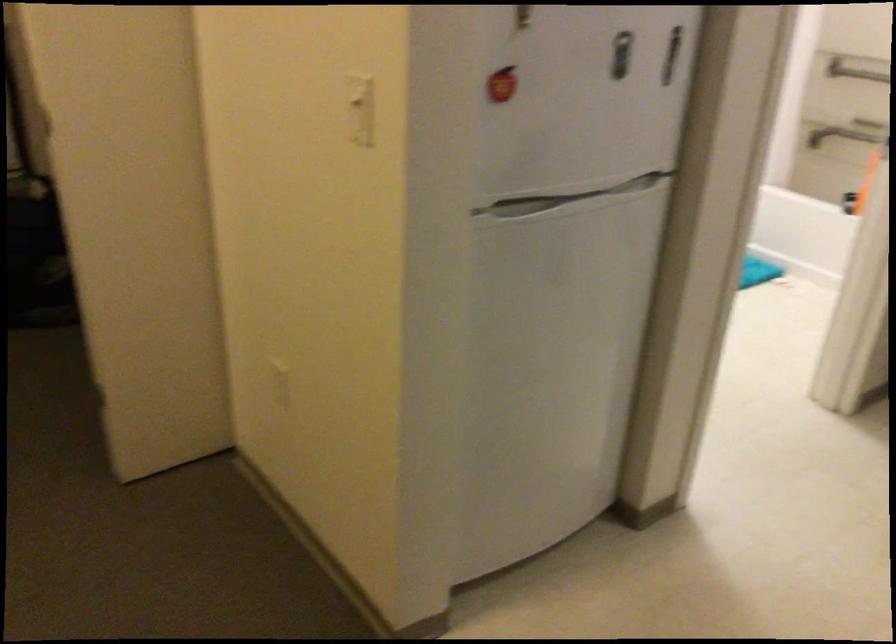
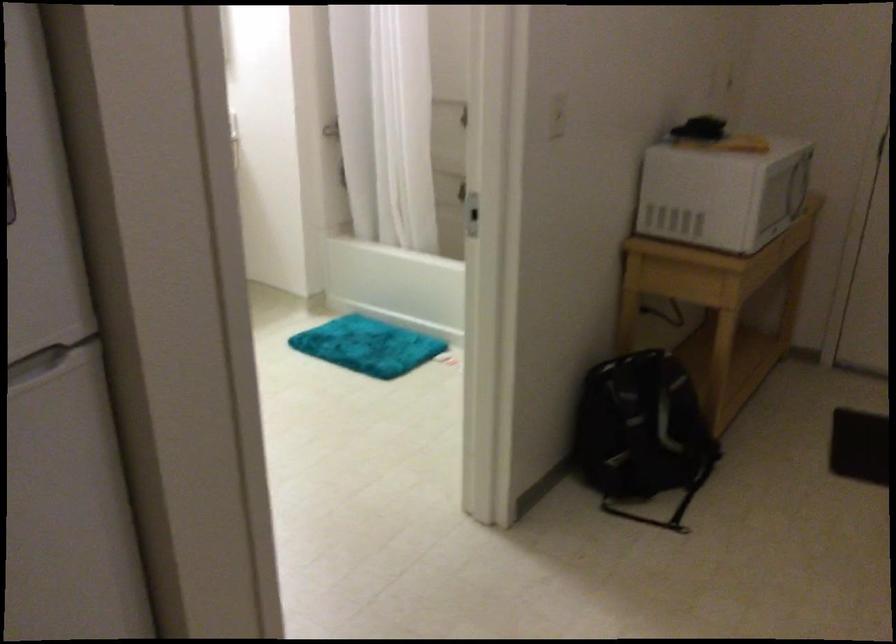
Question: The camera is either moving clockwise (left) or counter-clockwise (right) around the object. The first image is from the beginning of the video and the second image is from the end. Is the camera moving left or right when shooting the video?

Choices:
 (A) Left
 (B) Right

Answer: (A)